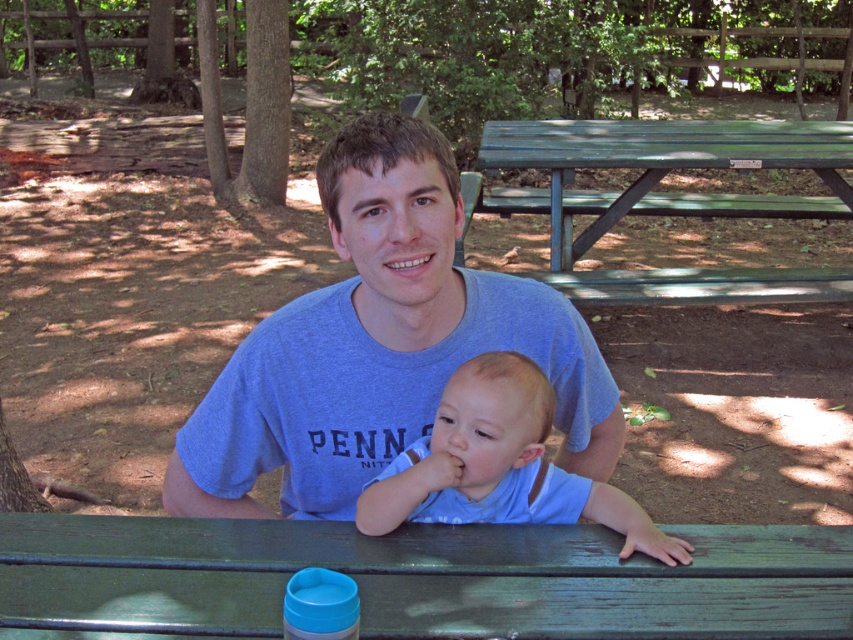
You are standing at the entrance of the park and want to find the green weathered wood table at center. According to the coordinates provided, where should you look relative to your current position?

The green weathered wood table at center is located at coordinates point (422, 579), so you should look towards the right and slightly forward from your current position at the entrance.

You are a photographer trying to capture a clear shot of the green weathered wood table at center and the green painted wood picnic table at upper center. Which table is blocking the view of the other?

The green painted wood picnic table at upper center is blocking the view of the green weathered wood table at center because it is positioned above it.